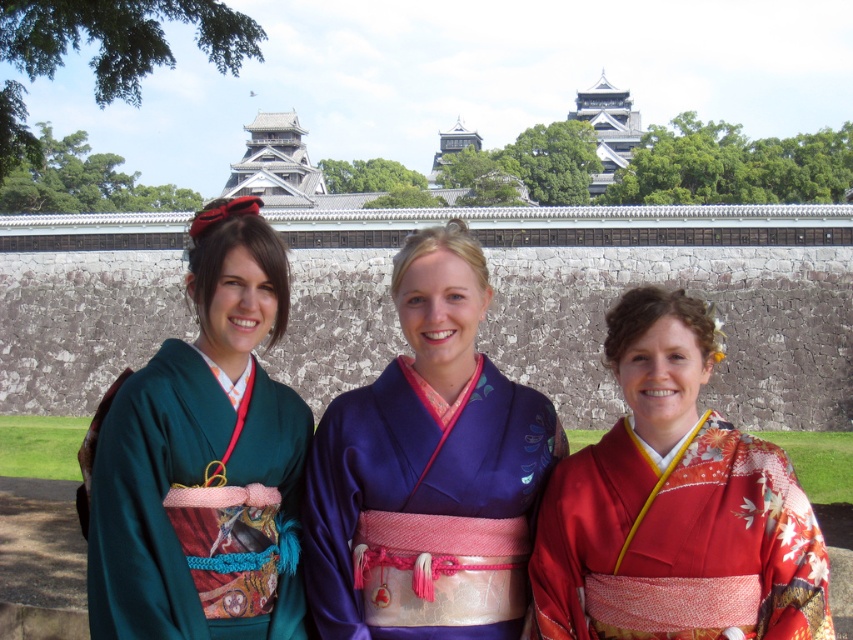
You are planning to take a photo of the silky blue kimono at center and the shiny red kimono at center. Since you want to capture both clearly, which kimono should you focus on first to ensure proper framing?

The silky blue kimono at center is smaller than the shiny red kimono at center, so you should focus on the shiny red kimono at center first to ensure it fits within the frame properly.

You are a photographer trying to capture the three kimono models in the scene. You notice a specific point at coordinates point (428,470). Which kimono is this point located on?

The point (428,470) is on the silky blue kimono at center.

You are an artist trying to sketch the scene. You notice two kimonos in the image. Which kimono is shorter in height between the silky blue kimono at center and the green silk kimono at left?

The silky blue kimono at center is shorter in height compared to the green silk kimono at left.